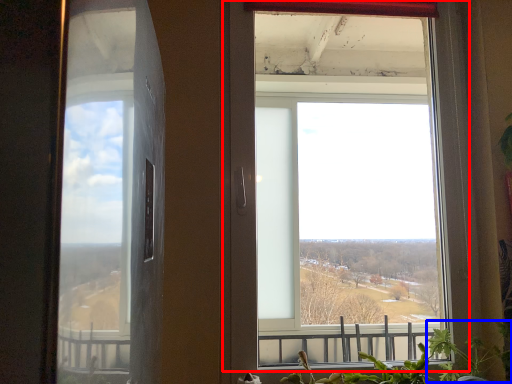
Question: Which object appears farthest to the camera in this image, window (highlighted by a red box) or plant (highlighted by a blue box)?

Choices:
 (A) window
 (B) plant

Answer: (A)